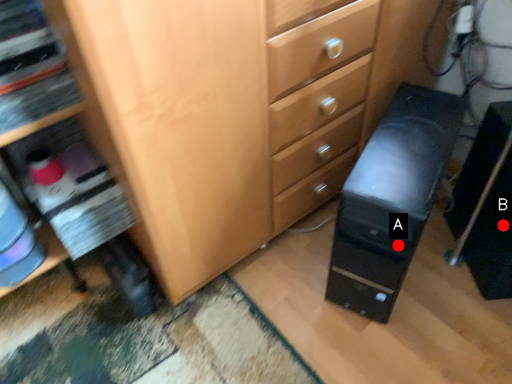
Question: Two points are circled on the image, labeled by A and B beside each circle. Which point is closer to the camera?

Choices:
 (A) A is closer
 (B) B is closer

Answer: (A)